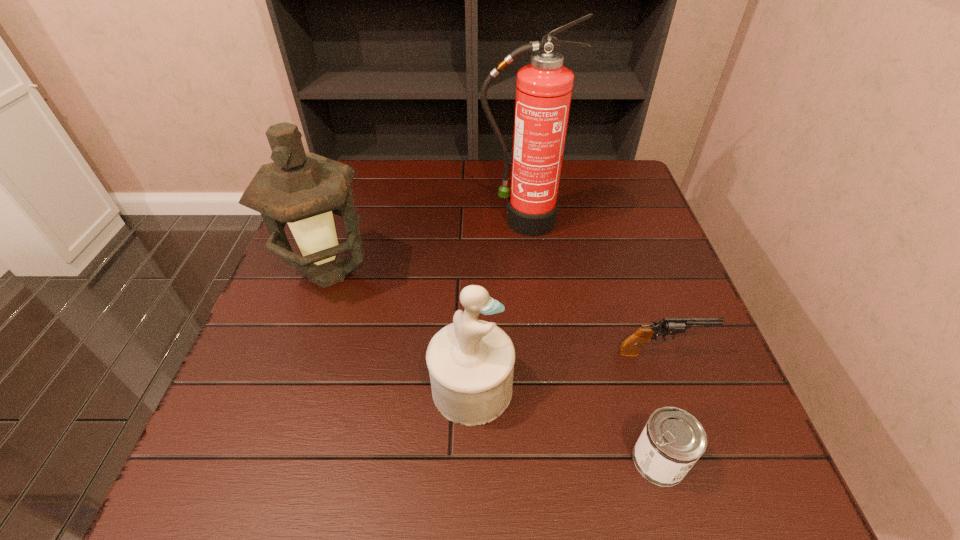
At what (x,y) coordinates should I click in order to perform the action: click on the farthest object. Please return your answer as a coordinate pair (x, y). Looking at the image, I should click on (544, 88).

This screenshot has height=540, width=960. I want to click on the tallest object, so click(544, 88).

The height and width of the screenshot is (540, 960). What are the coordinates of `the leftmost object` in the screenshot? It's located at (303, 190).

Identify the location of oil lamp. (303, 190).

Identify the location of the third tallest object. (471, 362).

I want to click on gun, so click(631, 346).

This screenshot has height=540, width=960. In order to click on the nearest object in this screenshot , I will do `click(672, 441)`.

Locate an element on the screen. This screenshot has height=540, width=960. free space located on the front-facing side of the fire extinguisher is located at coordinates (530, 298).

Where is `free space located 0.230m on the back of the leftmost object`? Image resolution: width=960 pixels, height=540 pixels. free space located 0.230m on the back of the leftmost object is located at coordinates pos(357,191).

Locate an element on the screen. Image resolution: width=960 pixels, height=540 pixels. free space located 0.230m at the beak of the figurine is located at coordinates (635, 388).